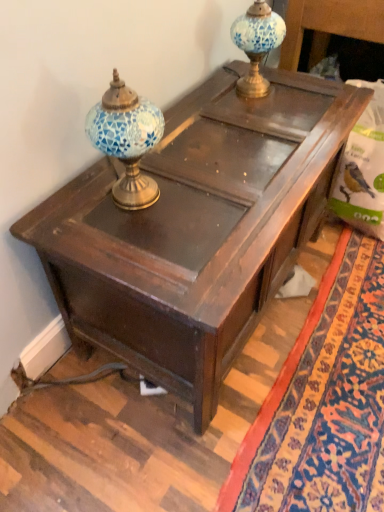
This screenshot has width=384, height=512. In order to click on free space in front of blue mosaic glass lamp at upper left, placed as the first candle holder when sorted from bottom to top in this screenshot , I will do `click(135, 239)`.